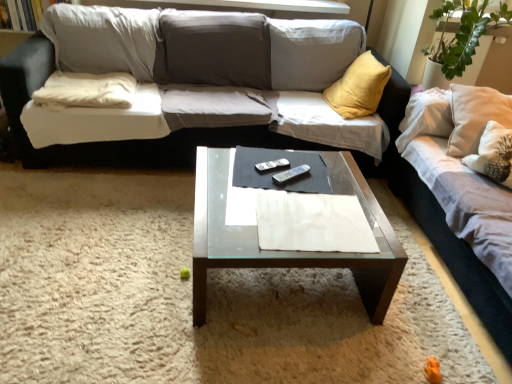
The image size is (512, 384). I want to click on vacant space in front of silver metallic remote at center, marked as the 2th remote in a bottom-to-top arrangement, so click(x=272, y=189).